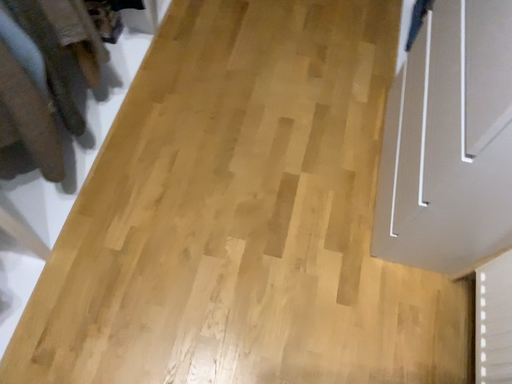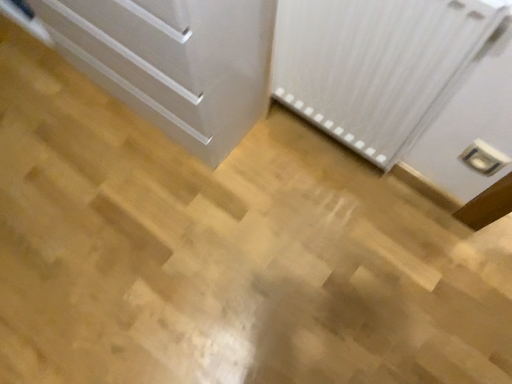
Question: Which way did the camera rotate in the video?

Choices:
 (A) rotated right
 (B) rotated left

Answer: (A)